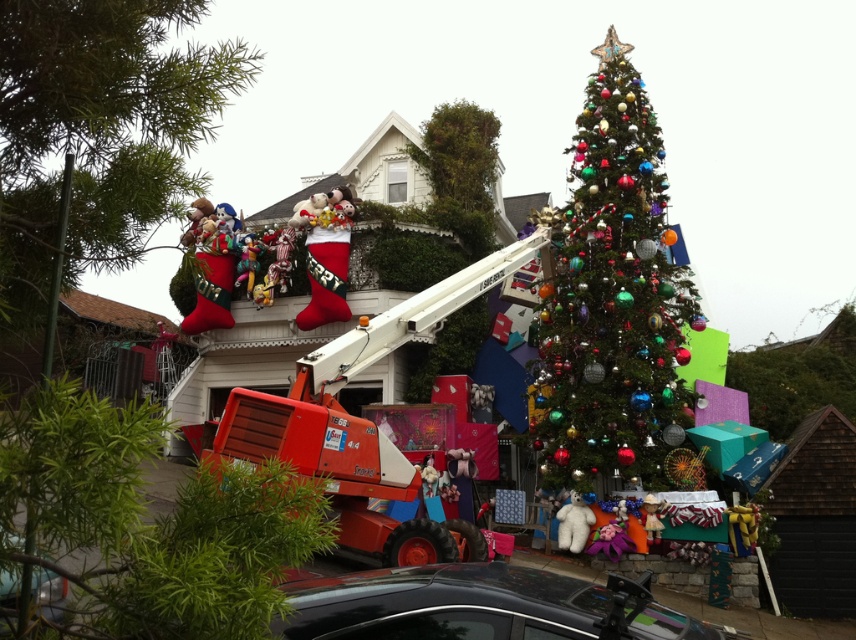
Is the position of shiny metallic tree at center more distant than that of shiny black car at lower center?

No, shiny metallic tree at center is in front of shiny black car at lower center.

Which of these two, shiny metallic tree at center or shiny black car at lower center, stands shorter?

shiny black car at lower center

Which is in front, point (270, 490) or point (301, 604)?

Positioned in front is point (270, 490).

What are the coordinates of `shiny metallic tree at center` in the screenshot? It's located at (146, 524).

Who is positioned more to the right, shiny metallic tree at center or red plush stockings at upper left?

Positioned to the right is shiny metallic tree at center.

Is point (191, 588) farther from camera compared to point (141, 19)?

No, it is not.

Locate an element on the screen. shiny metallic tree at center is located at coordinates (146, 524).

Is velvet plush santa at center below white plush bear at center?

No.

Who is shorter, velvet plush santa at center or white plush bear at center?

With less height is white plush bear at center.

The height and width of the screenshot is (640, 856). In order to click on velvet plush santa at center in this screenshot , I will do `click(325, 253)`.